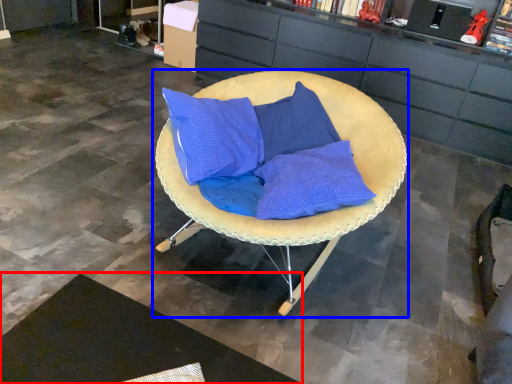
Question: Which of the following is the closest to the observer, mat (highlighted by a red box) or chair (highlighted by a blue box)?

Choices:
 (A) mat
 (B) chair

Answer: (A)